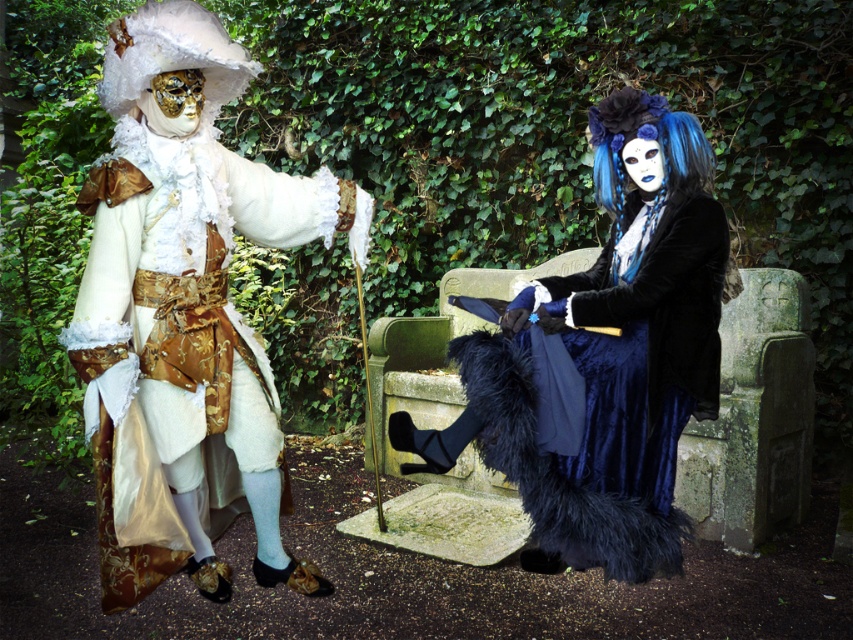
You are organizing a costume party and need to arrange the matte gold fabric coat at left and the velvet blue dress at center on a display rack. Given their widths, which costume should be placed on the narrower side of the rack to ensure proper fitting?

The matte gold fabric coat at left has a smaller width than the velvet blue dress at center, so it should be placed on the narrower side of the rack to fit appropriately.

You are an event planner arranging a photoshoot for a fashion show. You need to ensure that the matte gold fabric coat at left and the velvet blue dress at center are visible in the final shot. Based on their positions, which object is blocking the view of the other?

The matte gold fabric coat at left is positioned over the velvet blue dress at center, so it is blocking the view of the velvet blue dress at center.

You are a photographer trying to capture a photo of both the matte gold fabric coat at left and the velvet blue dress at center. Since you want both subjects to be in the frame, which direction should you move to ensure both are visible?

The matte gold fabric coat at left is to the left of the velvet blue dress at center. To capture both in the frame, move to the right side so that you can include both the left and center positions in your camera view.